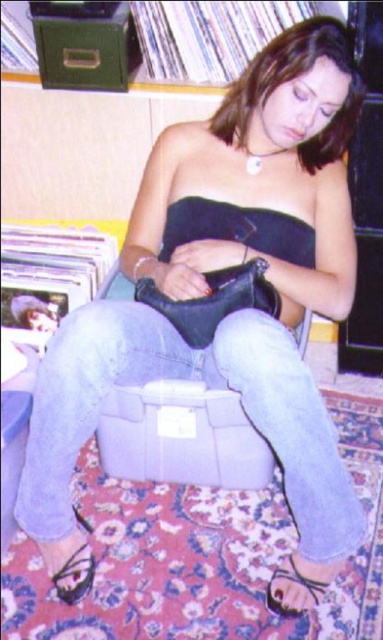
Question: Which object is farther from the camera taking this photo?

Choices:
 (A) denim jeans at center
 (B) black leather sandal at lower center
 (C) black leather sandal at lower left

Answer: (B)

Question: Which object is closer to the camera taking this photo?

Choices:
 (A) black leather sandal at lower center
 (B) denim jeans at center

Answer: (B)

Question: In this image, where is denim jeans at center located relative to black leather sandal at lower center?

Choices:
 (A) above
 (B) below

Answer: (A)

Question: Is the position of denim jeans at center less distant than that of black leather sandal at lower center?

Choices:
 (A) yes
 (B) no

Answer: (A)

Question: Which point is farther to the camera?

Choices:
 (A) (284, 593)
 (B) (34, 444)

Answer: (A)

Question: Does denim jeans at center have a larger size compared to black leather sandal at lower left?

Choices:
 (A) yes
 (B) no

Answer: (A)